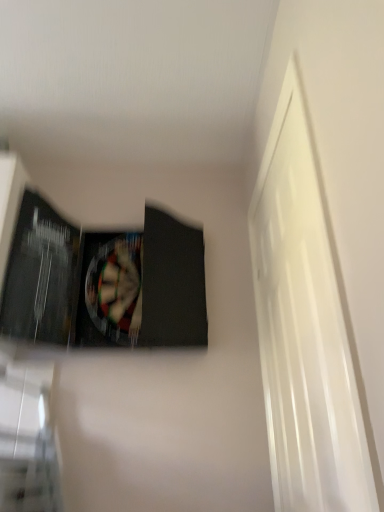
Question: From their relative heights in the image, would you say matte black paperback book at upper left is taller or shorter than white glossy door at right?

Choices:
 (A) tall
 (B) short

Answer: (B)

Question: Relative to white glossy door at right, is matte black paperback book at upper left in front or behind?

Choices:
 (A) front
 (B) behind

Answer: (B)

Question: Is matte black paperback book at upper left situated inside white glossy door at right or outside?

Choices:
 (A) inside
 (B) outside

Answer: (B)

Question: Is white glossy door at right inside the boundaries of matte black paperback book at upper left, or outside?

Choices:
 (A) inside
 (B) outside

Answer: (B)

Question: In terms of width, does white glossy door at right look wider or thinner when compared to matte black paperback book at upper left?

Choices:
 (A) thin
 (B) wide

Answer: (A)

Question: From the image's perspective, is white glossy door at right located above or below matte black paperback book at upper left?

Choices:
 (A) below
 (B) above

Answer: (A)

Question: Is white glossy door at right in front of or behind matte black paperback book at upper left in the image?

Choices:
 (A) behind
 (B) front

Answer: (B)